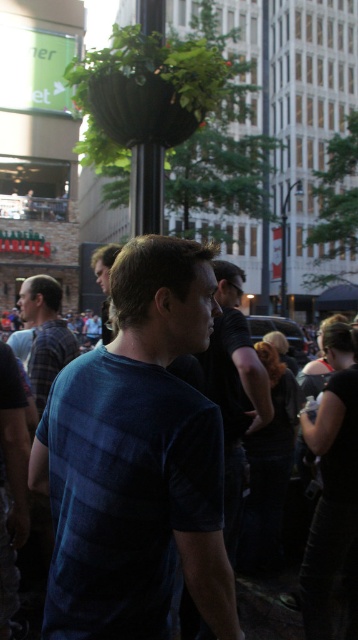
From the picture: You are a photographer trying to capture the man in the dark blue shirt at center. The camera you are using has a focus point at position (234, 390). Will this focus point align with the dark blue shirt at center?

The dark blue shirt at center is represented by point (234, 390), so yes, the focus point at (234, 390) will align with the dark blue shirt at center.